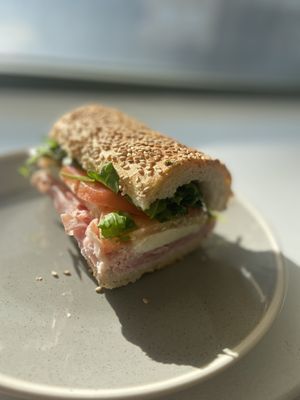
The height and width of the screenshot is (400, 300). Identify the location of window sill. (117, 83).